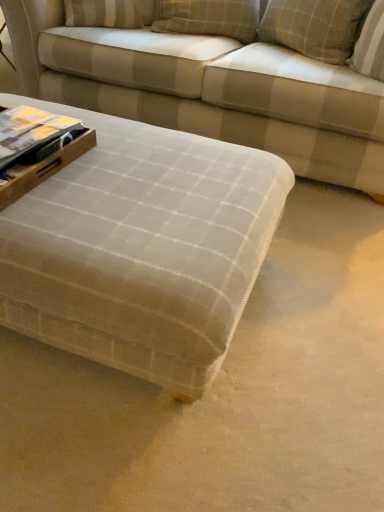
Question: Should I look upward or downward to see matte paper book at left?

Choices:
 (A) up
 (B) down

Answer: (A)

Question: Does textured beige fabric couch at center have a smaller size compared to plaid fabric pillow at upper right, which ranks as the first pillow in right-to-left order?

Choices:
 (A) no
 (B) yes

Answer: (A)

Question: Considering the relative sizes of textured beige fabric couch at center and plaid fabric pillow at upper right, positioned as the second pillow in left-to-right order, in the image provided, is textured beige fabric couch at center bigger than plaid fabric pillow at upper right, positioned as the second pillow in left-to-right order,?

Choices:
 (A) yes
 (B) no

Answer: (A)

Question: From a real-world perspective, is textured beige fabric couch at center positioned over plaid fabric pillow at upper right, positioned as the second pillow in left-to-right order, based on gravity?

Choices:
 (A) no
 (B) yes

Answer: (A)

Question: Can you confirm if textured beige fabric couch at center is wider than plaid fabric pillow at upper right, which ranks as the first pillow in right-to-left order?

Choices:
 (A) no
 (B) yes

Answer: (B)

Question: Does textured beige fabric couch at center have a greater height compared to plaid fabric pillow at upper right, positioned as the second pillow in left-to-right order?

Choices:
 (A) yes
 (B) no

Answer: (A)

Question: From the image's perspective, is textured beige fabric couch at center above plaid fabric pillow at upper right, which ranks as the first pillow in right-to-left order?

Choices:
 (A) no
 (B) yes

Answer: (A)

Question: Can you confirm if textured beige ottoman at center is positioned to the left of matte paper book at left?

Choices:
 (A) no
 (B) yes

Answer: (A)

Question: From the image's perspective, is textured beige ottoman at center on matte paper book at left?

Choices:
 (A) no
 (B) yes

Answer: (A)

Question: Considering the relative sizes of textured beige ottoman at center and matte paper book at left in the image provided, is textured beige ottoman at center smaller than matte paper book at left?

Choices:
 (A) yes
 (B) no

Answer: (B)

Question: Are textured beige ottoman at center and matte paper book at left beside each other?

Choices:
 (A) no
 (B) yes

Answer: (A)

Question: Could matte paper book at left be considered to be inside textured beige ottoman at center?

Choices:
 (A) yes
 (B) no

Answer: (B)

Question: Could you tell me if textured beige ottoman at center is facing matte paper book at left?

Choices:
 (A) no
 (B) yes

Answer: (A)

Question: Is plaid fabric pillow at upper center, which ranks as the second pillow in right-to-left order, shorter than textured beige fabric couch at center?

Choices:
 (A) no
 (B) yes

Answer: (B)